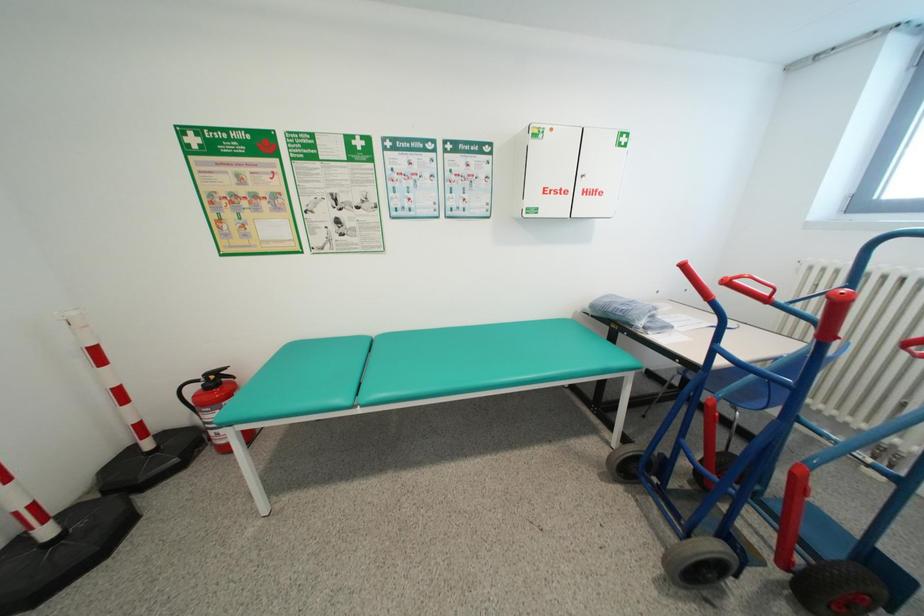
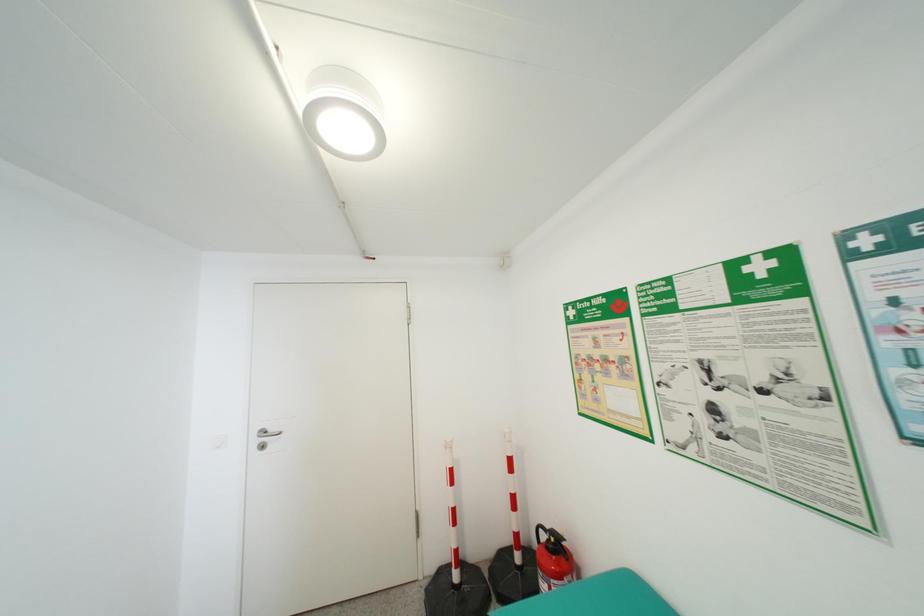
Question: The camera is either moving clockwise (left) or counter-clockwise (right) around the object. The first image is from the beginning of the video and the second image is from the end. Is the camera moving left or right when shooting the video?

Choices:
 (A) Left
 (B) Right

Answer: (B)